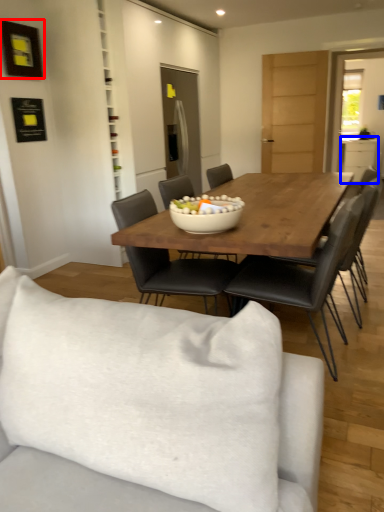
Question: Among these objects, which one is nearest to the camera, picture frame (highlighted by a red box) or cabinetry (highlighted by a blue box)?

Choices:
 (A) picture frame
 (B) cabinetry

Answer: (A)